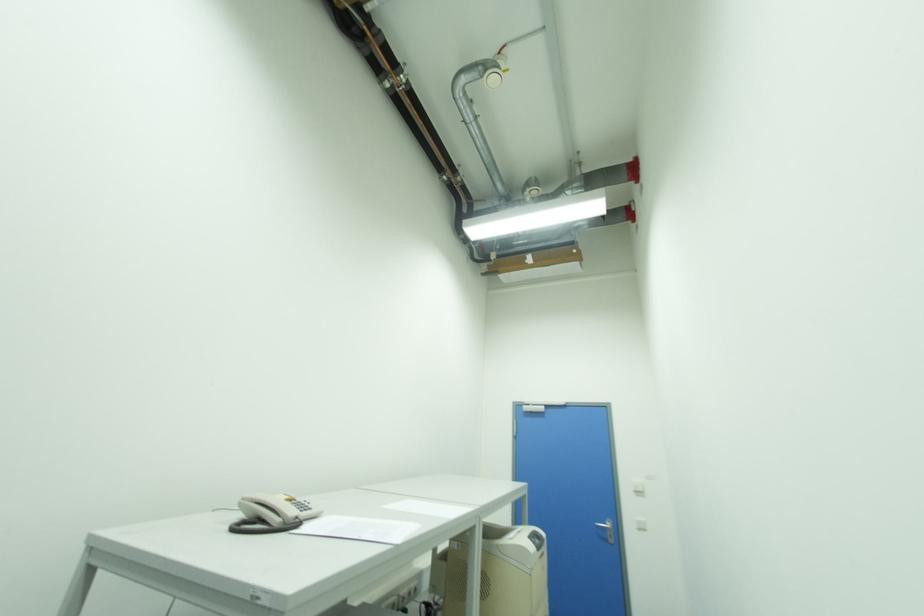
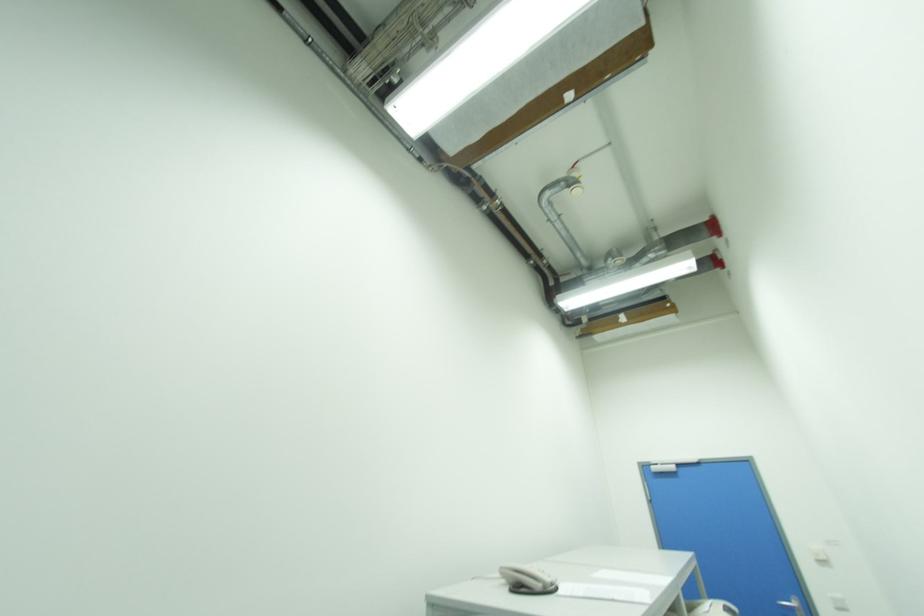
Question: Based on the continuous images, in which direction is the camera rotating? Reply with the corresponding letter.

Choices:
 (A) Left
 (B) Right
 (C) Up
 (D) Down

Answer: (C)